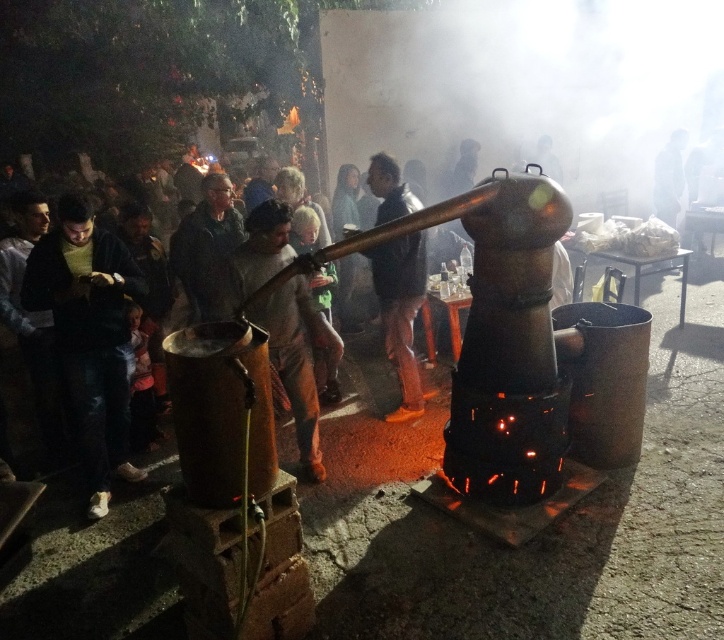
You are a photographer at the event and want to capture a photo of the dark green sweater at left and the dark gray jacket at center. Which one is closer to the camera?

The dark green sweater at left is closer to the camera because it is in front of the dark gray jacket at center.

You are a photographer standing at the back of the crowd. You want to take a photo of the shiny black pants at center and the dark gray jacket at center. Which object will appear larger in your photo?

The shiny black pants at center will appear larger in the photo because it is closer to the viewer than the dark gray jacket at center.